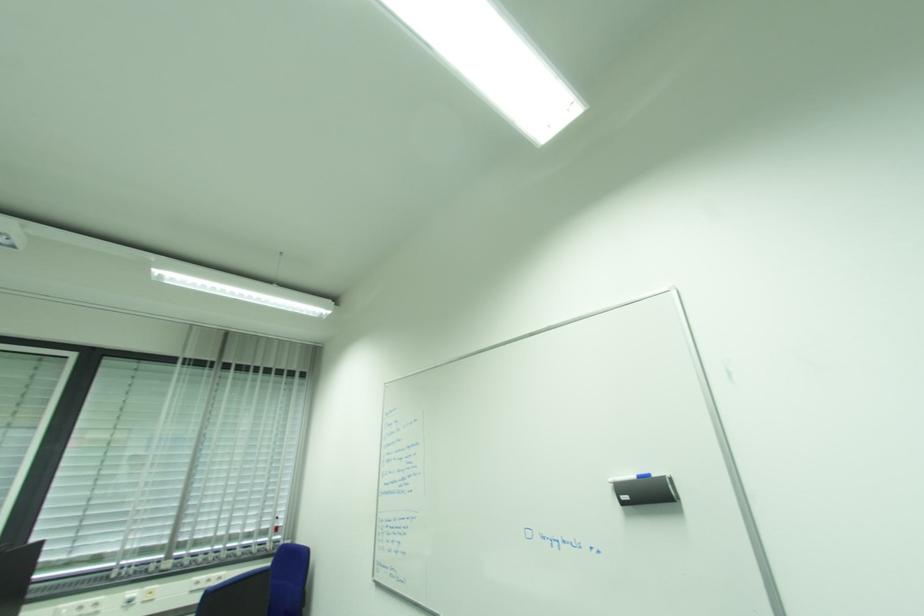
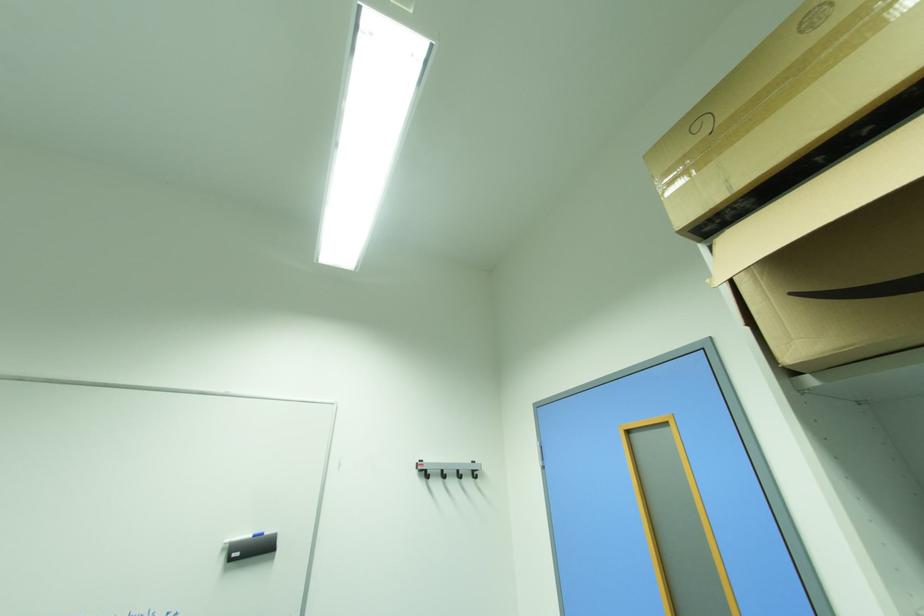
Based on the continuous images, in which direction is the camera rotating?

The rotation direction of the camera is right-up.